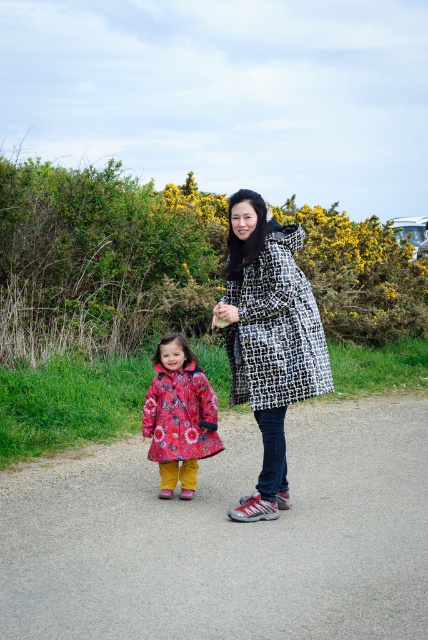
You are standing at the point with coordinates point (276, 241) and want to walk towards the point with coordinates point (198, 588). Which direction should you move to reach your destination?

You should move forward because point (198, 588) is in front of point (276, 241).